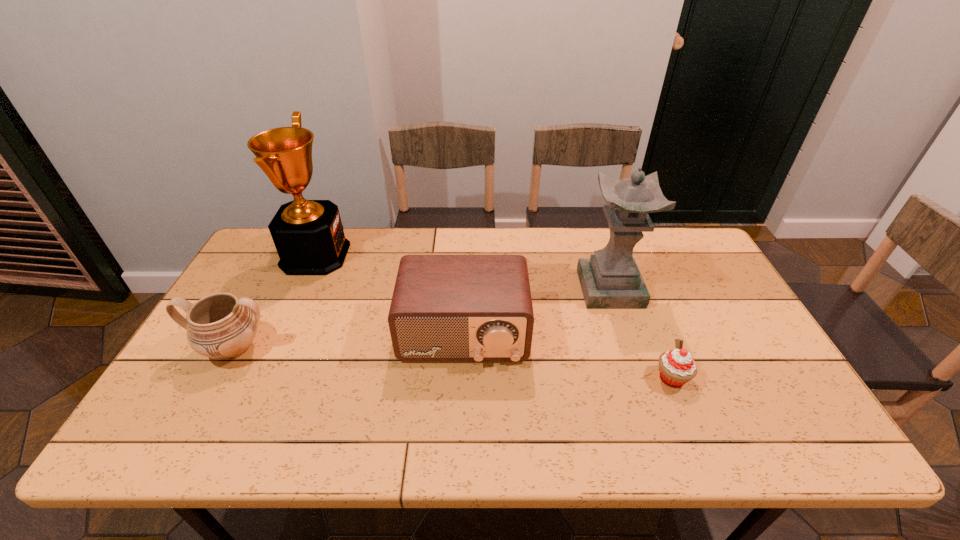
I want to click on trophy cup, so click(308, 235).

The image size is (960, 540). Identify the location of sculpture. (610, 279).

The height and width of the screenshot is (540, 960). Find the location of `radio receiver`. radio receiver is located at coordinates (444, 307).

The height and width of the screenshot is (540, 960). In order to click on urn in this screenshot , I will do `click(221, 326)`.

The width and height of the screenshot is (960, 540). What are the coordinates of `cupcake` in the screenshot? It's located at (677, 367).

Locate an element on the screen. Image resolution: width=960 pixels, height=540 pixels. free space located on the front of the trophy cup with the label is located at coordinates (407, 255).

You are a GUI agent. You are given a task and a screenshot of the screen. Output one action in this format:
    pyautogui.click(x=<x>, y=<y>)
    Task: Click on the free point located 0.250m at the front opening of the sculpture
    
    Given the screenshot: What is the action you would take?
    pyautogui.click(x=640, y=381)

Where is `free space located on the front panel of the third object from right to left`? This screenshot has width=960, height=540. free space located on the front panel of the third object from right to left is located at coordinates (460, 441).

I want to click on free space located 0.150m on the front-facing side of the urn, so click(x=191, y=428).

The height and width of the screenshot is (540, 960). What are the coordinates of `vacant space located 0.060m on the right of the shortest object` in the screenshot? It's located at (713, 378).